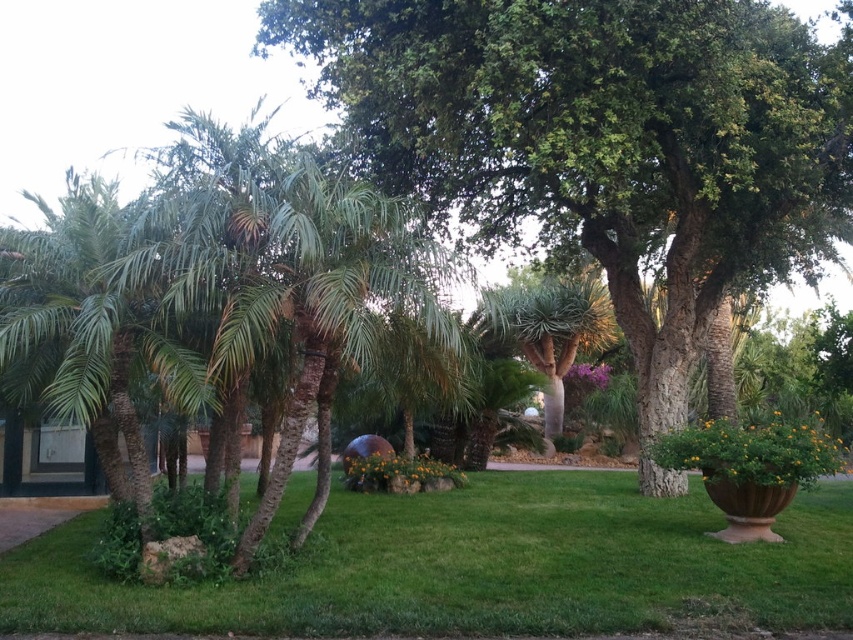
You are standing in the garden and want to take a photo of both the point at coordinates (543, 205) and the point at coordinates (839, 579). Which point should you focus on first to ensure both are in focus?

You should focus on the point at coordinates (543, 205) first because it is closer to the camera than the point at coordinates (839, 579). By focusing on the closer point, the farther point will also be within the depth of field, ensuring both are in focus.

Consider the image. You are standing in the garden and want to reach the point at coordinates point (131, 627). Considering your height is 5 feet, can you walk to that point without any obstacles?

The point (131, 627) is 17.58 feet away from the viewer, so yes, you can walk to that point as there are no obstacles mentioned in the scene description.